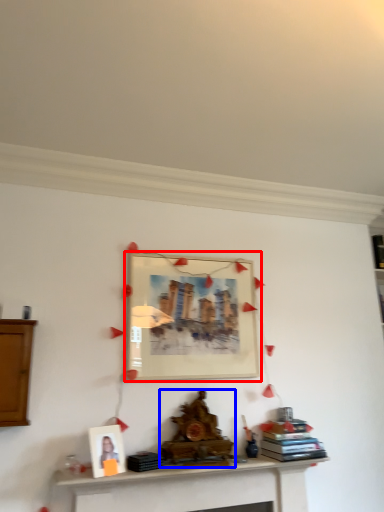
Question: Which object appears farthest to the camera in this image, picture frame (highlighted by a red box) or fireplace (highlighted by a blue box)?

Choices:
 (A) picture frame
 (B) fireplace

Answer: (A)